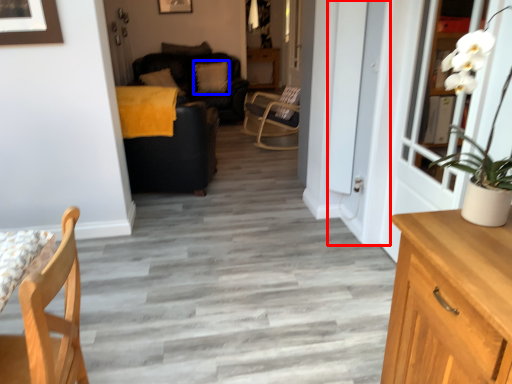
Question: Which of the following is the closest to the observer, screen door (highlighted by a red box) or pillow (highlighted by a blue box)?

Choices:
 (A) screen door
 (B) pillow

Answer: (A)